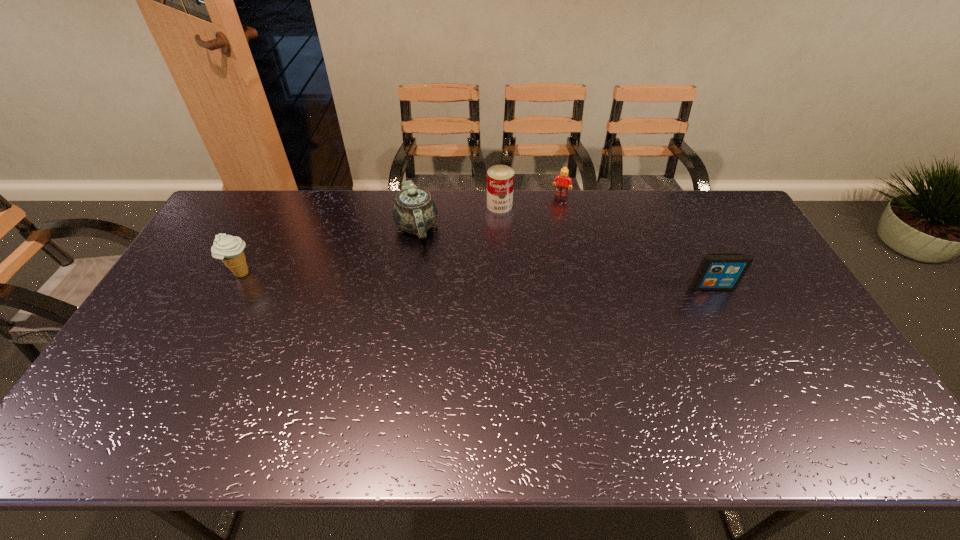
The height and width of the screenshot is (540, 960). Identify the location of the leftmost object. (229, 249).

Identify the location of the rightmost object. This screenshot has width=960, height=540. (717, 271).

Identify the location of can. (500, 178).

You are a GUI agent. You are given a task and a screenshot of the screen. Output one action in this format:
    pyautogui.click(x=<x>, y=<y>)
    Task: Click on the chinaware
    
    Given the screenshot: What is the action you would take?
    pyautogui.click(x=414, y=211)

At what (x,y) coordinates should I click in order to perform the action: click on Lego. Please return your answer as a coordinate pair (x, y). This screenshot has height=540, width=960. Looking at the image, I should click on (564, 182).

The height and width of the screenshot is (540, 960). I want to click on free space located 0.340m on the right of the leftmost object, so click(367, 274).

Find the location of a particular element. vacant area situated 0.230m on the front screen of the rightmost object is located at coordinates (746, 355).

I want to click on vacant space located on the front label of the third object from left to right, so click(x=499, y=271).

Where is `vacant area situated 0.090m on the front label of the third object from left to right`? The width and height of the screenshot is (960, 540). vacant area situated 0.090m on the front label of the third object from left to right is located at coordinates (499, 230).

Where is `free space located 0.330m on the front label of the third object from left to right`? free space located 0.330m on the front label of the third object from left to right is located at coordinates (499, 280).